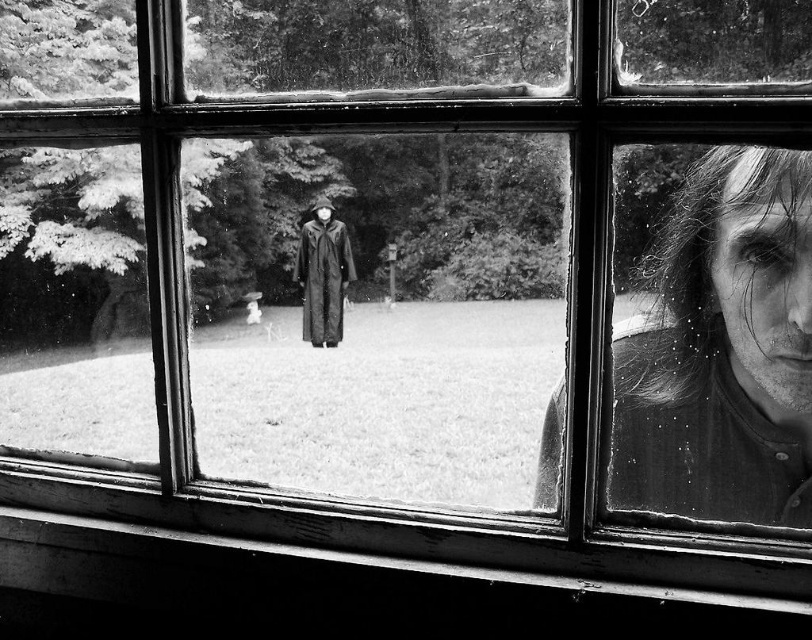
Question: Which point is closer to the camera?

Choices:
 (A) (326, 225)
 (B) (703, 353)

Answer: (B)

Question: Does smooth skin face at right have a lesser width compared to matte black robe at center?

Choices:
 (A) yes
 (B) no

Answer: (B)

Question: Does smooth skin face at right appear over matte black robe at center?

Choices:
 (A) no
 (B) yes

Answer: (A)

Question: Does smooth skin face at right have a lesser width compared to matte black robe at center?

Choices:
 (A) no
 (B) yes

Answer: (A)